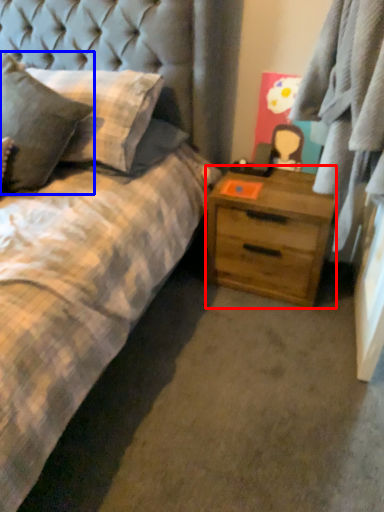
Question: Which object is further to the camera taking this photo, chest of drawers (highlighted by a red box) or pillow (highlighted by a blue box)?

Choices:
 (A) chest of drawers
 (B) pillow

Answer: (A)